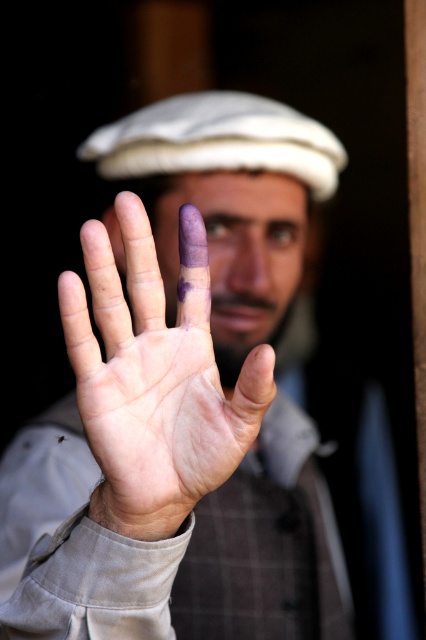
Question: Does purple matte hand at center come in front of purple matte palm at center?

Choices:
 (A) yes
 (B) no

Answer: (B)

Question: Where is purple matte hand at center located in relation to purple matte palm at center in the image?

Choices:
 (A) above
 (B) below

Answer: (B)

Question: Does purple matte hand at center appear on the right side of purple matte palm at center?

Choices:
 (A) no
 (B) yes

Answer: (A)